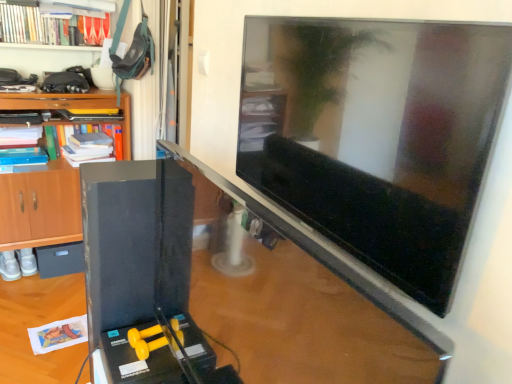
Question: In terms of height, does satin black monitor at center look taller or shorter compared to black matte drawer at lower left?

Choices:
 (A) short
 (B) tall

Answer: (B)

Question: Looking at their shapes, would you say satin black monitor at center is wider or thinner than black matte drawer at lower left?

Choices:
 (A) thin
 (B) wide

Answer: (A)

Question: Which object is positioned farthest from the wooden cabinet at left?

Choices:
 (A) hardcover book at upper left, placed as the 1th book when sorted from top to bottom
 (B) black matte drawer at lower left
 (C) satin black monitor at center
 (D) green matte book at upper left, which is counted as the 2th book, starting from the top
 (E) matte black tv at upper right

Answer: (E)

Question: Estimate the real-world distances between objects in this image. Which object is closer to the satin black monitor at center?

Choices:
 (A) green matte book at upper left, which is counted as the 2th book, starting from the top
 (B) wooden cabinet at left
 (C) matte black tv at upper right
 (D) hardcover book at upper left, placed as the 1th book when sorted from top to bottom
 (E) black matte drawer at lower left

Answer: (C)